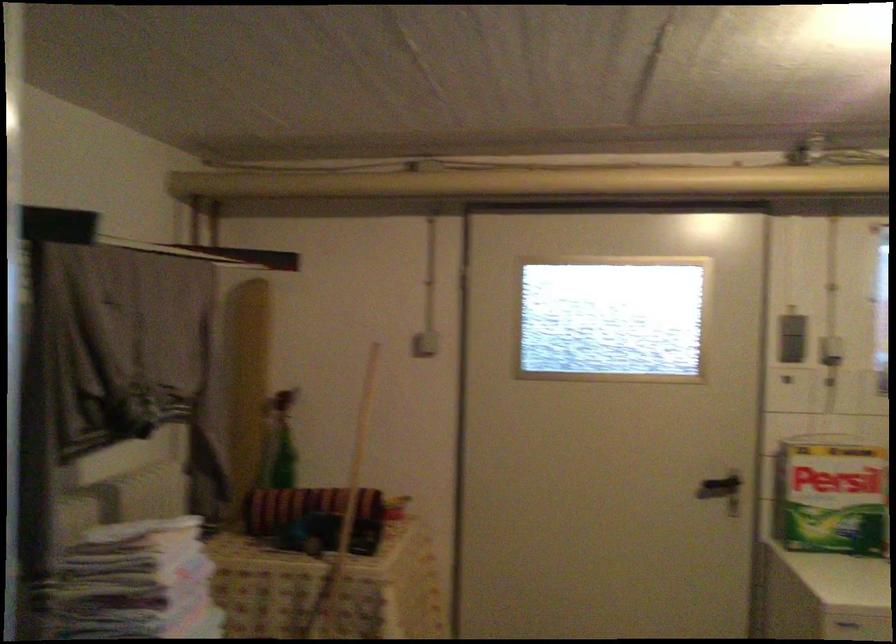
The width and height of the screenshot is (896, 644). What do you see at coordinates (720, 488) in the screenshot? I see `the dark door handle` at bounding box center [720, 488].